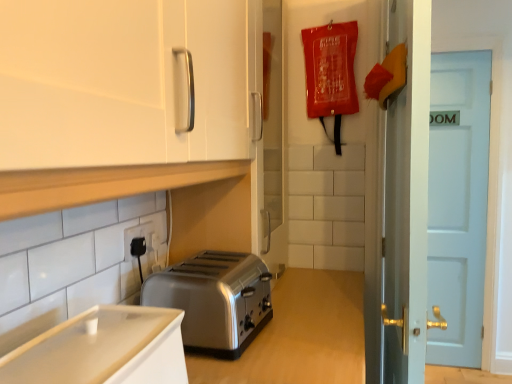
Locate an element on the screen. The height and width of the screenshot is (384, 512). free space above white wooden door at right (from a real-world perspective) is located at coordinates (464, 42).